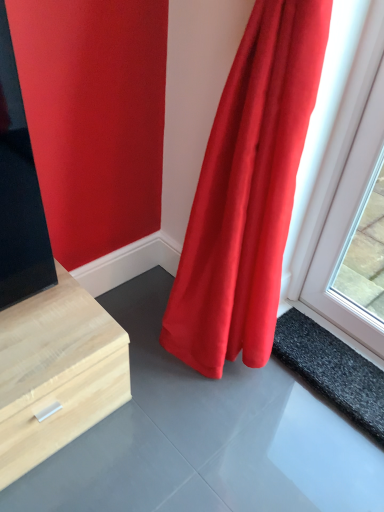
This screenshot has width=384, height=512. I want to click on free region under matte red curtain at right (from a real-world perspective), so click(248, 383).